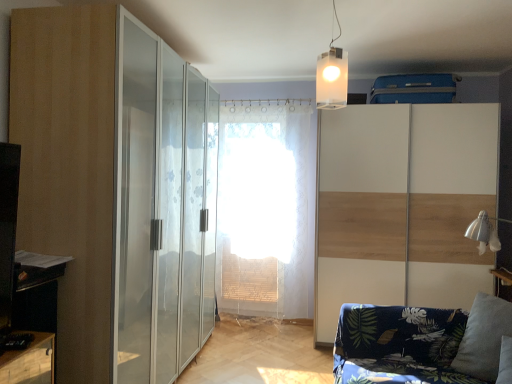
Question: From the image's perspective, is translucent plastic cube at upper center positioned above or below white wood screen door at right, the 1th screen door when ordered from right to left?

Choices:
 (A) below
 (B) above

Answer: (B)

Question: Is translucent plastic cube at upper center to the left or to the right of white wood screen door at right, the 1th screen door when ordered from right to left, in the image?

Choices:
 (A) right
 (B) left

Answer: (B)

Question: Which is farther from the white sheer curtain at center?

Choices:
 (A) white wood screen door at right, the 1th screen door when ordered from right to left
 (B) matte glass door at left
 (C) transparent glass wardrobe at center, which is counted as the 1th screen door, starting from the left
 (D) gray fabric pillow at lower right
 (E) dark blue fabric couch at lower right

Answer: (D)

Question: Which object is positioned farthest from the dark blue fabric couch at lower right?

Choices:
 (A) white wood screen door at right, acting as the second screen door starting from the left
 (B) translucent plastic cube at upper center
 (C) matte glass door at left
 (D) transparent glass wardrobe at center, which is counted as the 1th screen door, starting from the left
 (E) white sheer curtain at center

Answer: (E)